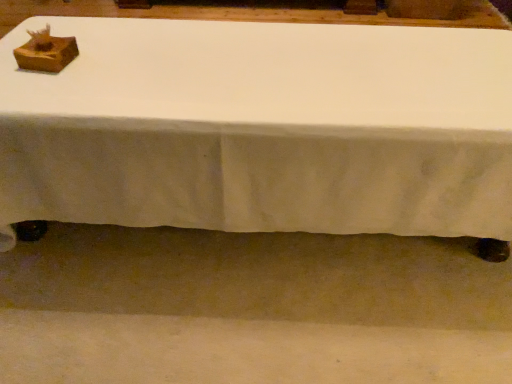
Question: Is wooden box at upper left to the right of white fabric table at center from the viewer's perspective?

Choices:
 (A) yes
 (B) no

Answer: (B)

Question: Is white fabric table at center a part of wooden box at upper left?

Choices:
 (A) no
 (B) yes

Answer: (A)

Question: Is wooden box at upper left next to white fabric table at center?

Choices:
 (A) no
 (B) yes

Answer: (A)

Question: Is wooden box at upper left positioned beyond the bounds of white fabric table at center?

Choices:
 (A) no
 (B) yes

Answer: (B)

Question: Is wooden box at upper left positioned far away from white fabric table at center?

Choices:
 (A) no
 (B) yes

Answer: (A)

Question: Is wooden box at upper left positioned behind white fabric table at center?

Choices:
 (A) yes
 (B) no

Answer: (A)

Question: Are white fabric table at center and wooden box at upper left making contact?

Choices:
 (A) yes
 (B) no

Answer: (B)

Question: Does white fabric table at center appear on the left side of wooden box at upper left?

Choices:
 (A) yes
 (B) no

Answer: (B)

Question: Is white fabric table at center bigger than wooden box at upper left?

Choices:
 (A) no
 (B) yes

Answer: (B)

Question: Can wooden box at upper left be found inside white fabric table at center?

Choices:
 (A) yes
 (B) no

Answer: (B)

Question: Is white fabric table at center oriented towards wooden box at upper left?

Choices:
 (A) yes
 (B) no

Answer: (B)

Question: From the image's perspective, is white fabric table at center on wooden box at upper left?

Choices:
 (A) yes
 (B) no

Answer: (A)

Question: Visually, is wooden box at upper left positioned to the left or to the right of white fabric table at center?

Choices:
 (A) right
 (B) left

Answer: (B)